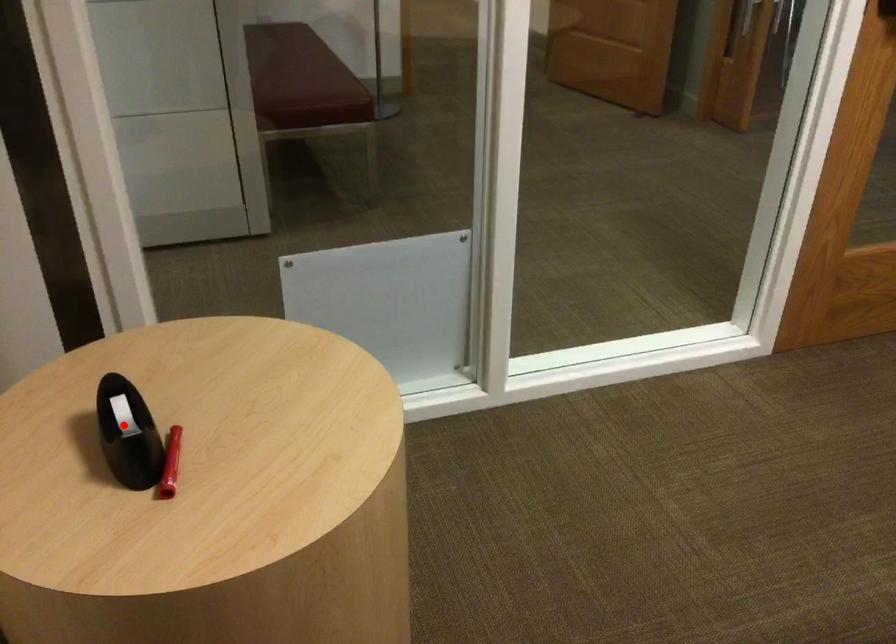
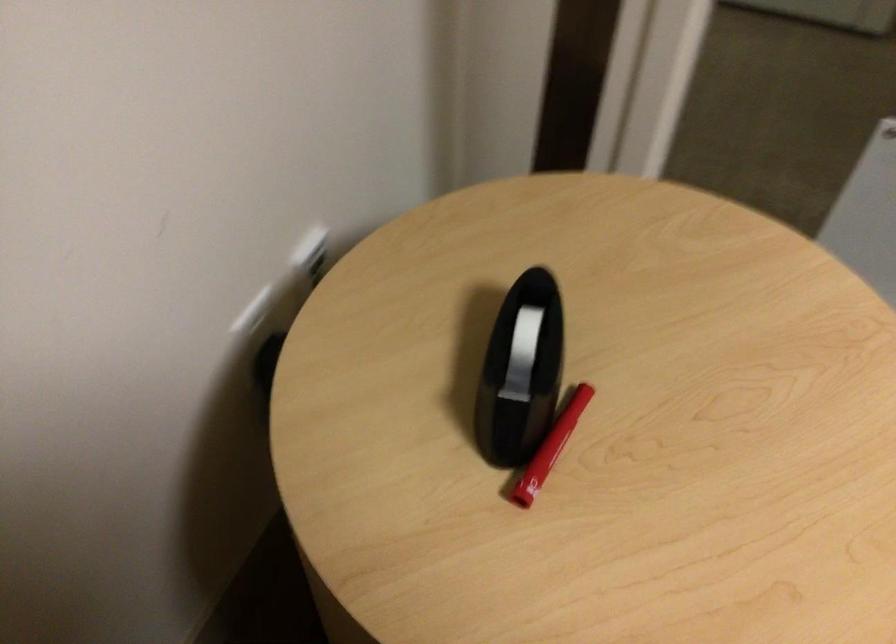
Question: I am providing you with two images of the same scene from different viewpoints. A red point is shown in image1. For the corresponding object point in image2, is it positioned nearer or farther from the camera?

Choices:
 (A) Nearer
 (B) Farther

Answer: (A)